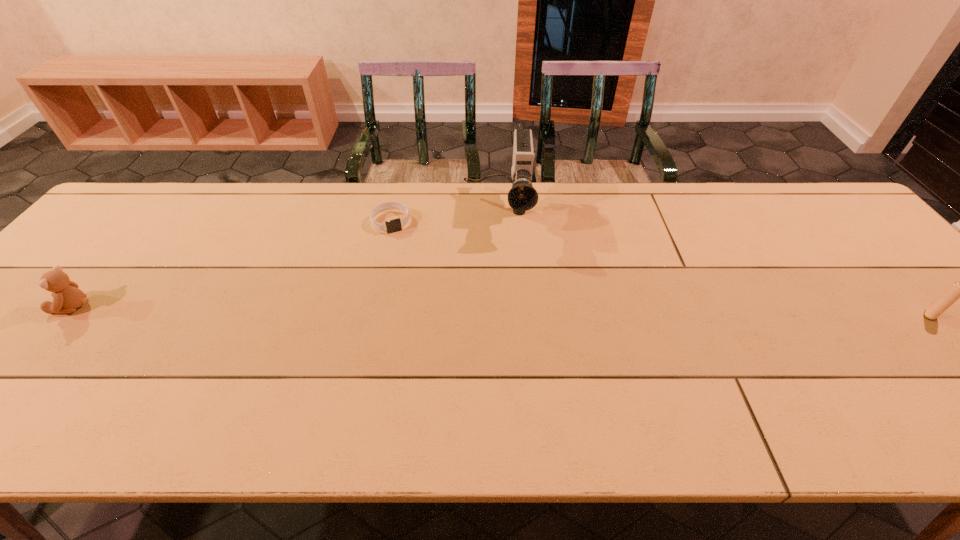
Find the location of a particular element. teddy bear is located at coordinates (67, 297).

The image size is (960, 540). Find the location of `igniter`. igniter is located at coordinates (957, 290).

Image resolution: width=960 pixels, height=540 pixels. What are the coordinates of `the tallest object` in the screenshot? It's located at (522, 196).

This screenshot has height=540, width=960. In order to click on the third object from left to right in this screenshot , I will do `click(522, 196)`.

This screenshot has width=960, height=540. I want to click on the second object from left to right, so click(x=395, y=225).

Where is `the shortest object`? the shortest object is located at coordinates (395, 225).

You are a GUI agent. You are given a task and a screenshot of the screen. Output one action in this format:
    pyautogui.click(x=<x>, y=<y>)
    Task: Click on the vacant space located on the front-facing side of the leftmost object
    
    Given the screenshot: What is the action you would take?
    pyautogui.click(x=31, y=306)

Find the location of a particular element. The width and height of the screenshot is (960, 540). vacant space positioned on the back of the rightmost object is located at coordinates (880, 260).

Locate an element on the screen. This screenshot has height=540, width=960. free point located on the recording direction of the tallest object is located at coordinates (495, 279).

Identify the location of free space located 0.250m on the recording direction of the tallest object. Image resolution: width=960 pixels, height=540 pixels. (494, 313).